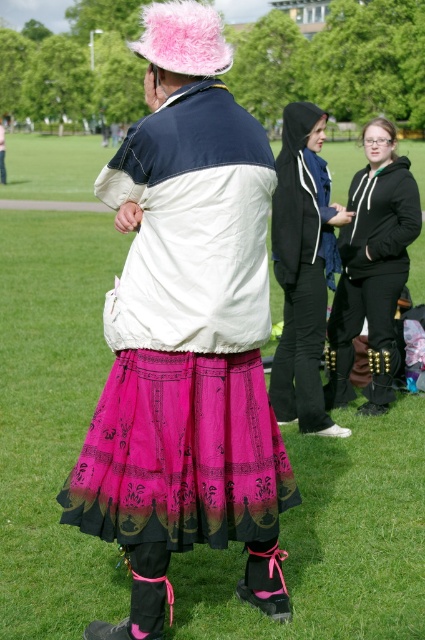
Question: Which point is closer to the camera?

Choices:
 (A) black hoodie at center
 (B) pink feathered hat at upper center

Answer: (B)

Question: Considering the relative positions of black leather boots at right and pink feathered hat at upper center in the image provided, where is black leather boots at right located with respect to pink feathered hat at upper center?

Choices:
 (A) below
 (B) above

Answer: (A)

Question: Is pink sheer skirt at center positioned in front of pink feathered hat at upper center?

Choices:
 (A) yes
 (B) no

Answer: (A)

Question: Which point is farther from the camera taking this photo?

Choices:
 (A) (405, 220)
 (B) (164, 324)
 (C) (209, 32)
 (D) (317, 268)

Answer: (A)

Question: Which of the following is the farthest from the observer?

Choices:
 (A) pink sheer skirt at center
 (B) black leather boots at right
 (C) black hoodie at center
 (D) pink feathered hat at upper center

Answer: (B)

Question: Is black hoodie at center above pink feathered hat at upper center?

Choices:
 (A) yes
 (B) no

Answer: (B)